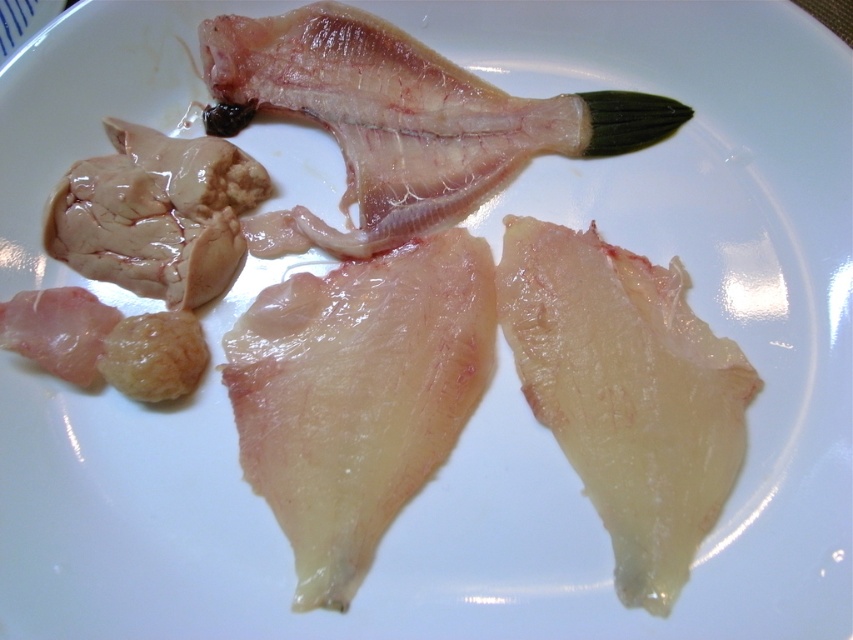
Is point (321, 317) closer to camera compared to point (560, 112)?

That is True.

Who is taller, translucent flesh at center or translucent flesh fish at upper center?

With more height is translucent flesh at center.

Is point (338, 544) farther from camera compared to point (407, 122)?

No, (338, 544) is in front of (407, 122).

Identify the location of translucent flesh at center. (358, 396).